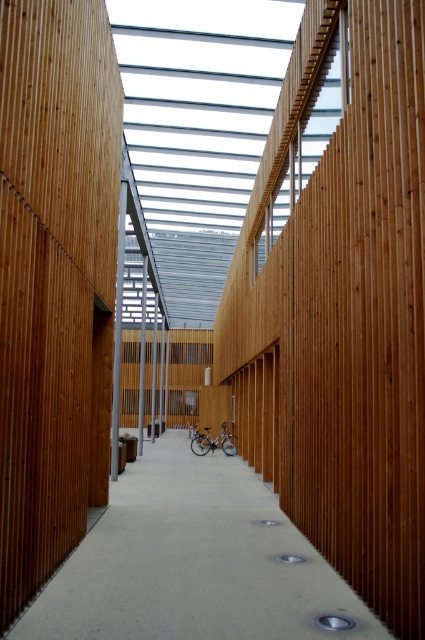
From the picture: You are a maintenance worker in the corridor. You need to place a heavy equipment box on the floor. The box is too heavy to lift, so you must roll it. The box is currently at the natural wood pillar at center. You want to roll it to the concrete at center. Is this possible?

The natural wood pillar at center is positioned over concrete at center, so you cannot roll the box from the natural wood pillar at center to the concrete at center because the pillar is blocking the path.

Based on the photo, you are standing in the corridor and need to move the silver metallic bicycle at center to the right side of the natural wood pillar at center. Is this possible without moving the pillar?

The natural wood pillar at center is currently to the left of the silver metallic bicycle at center. To move the bicycle to the right side of the pillar, you would need to reposition it around the pillar, which is possible as long as there is enough space around the pillar to maneuver the bicycle without moving the pillar itself.